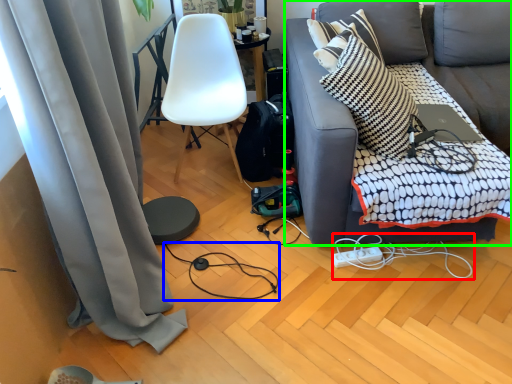
Question: Considering the real-world distances, which object is closest to string (highlighted by a red box)? wire (highlighted by a blue box) or studio couch (highlighted by a green box).

Choices:
 (A) wire
 (B) studio couch

Answer: (B)